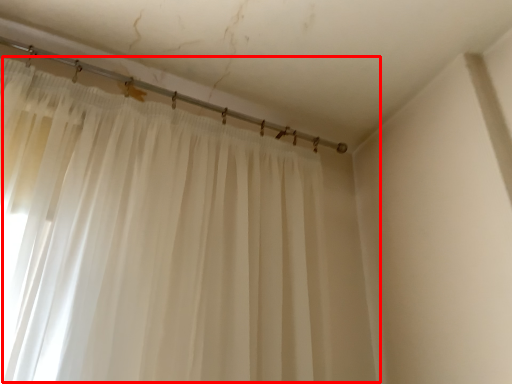
Question: From the image's perspective, where is curtain (annotated by the red box) located in relation to beam in the image?

Choices:
 (A) below
 (B) above

Answer: (A)